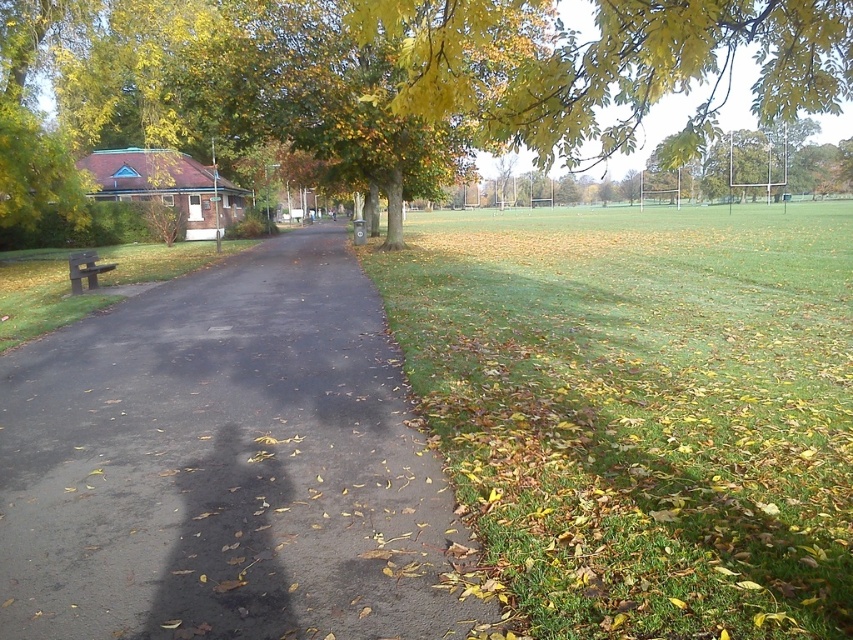
Can you confirm if green grass at right is smaller than green leafy tree at upper center?

Correct, green grass at right occupies less space than green leafy tree at upper center.

Who is more forward, [541,429] or [10,163]?

Point [541,429] is more forward.

I want to click on green grass at right, so click(643, 410).

This screenshot has width=853, height=640. I want to click on green grass at right, so click(643, 410).

Can you confirm if black asphalt pavement at left is thinner than metallic park bench at left?

Indeed, black asphalt pavement at left has a lesser width compared to metallic park bench at left.

Is point (183, 621) behind point (73, 289)?

No, (183, 621) is in front of (73, 289).

Locate an element on the screen. The width and height of the screenshot is (853, 640). black asphalt pavement at left is located at coordinates (225, 465).

Find the location of a particular element. The height and width of the screenshot is (640, 853). black asphalt pavement at left is located at coordinates (225, 465).

Does green leafy tree at upper center lie behind metallic park bench at left?

No, green leafy tree at upper center is closer to the viewer.

Is point (49, 54) positioned in front of point (83, 253)?

No, (49, 54) is behind (83, 253).

The height and width of the screenshot is (640, 853). I want to click on green leafy tree at upper center, so click(x=395, y=77).